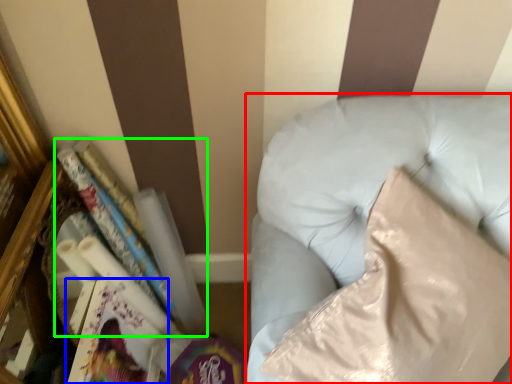
Question: Which object is the closest to the furniture (highlighted by a red box)? Choose among these: paperback book (highlighted by a blue box) or book (highlighted by a green box).

Choices:
 (A) paperback book
 (B) book

Answer: (B)